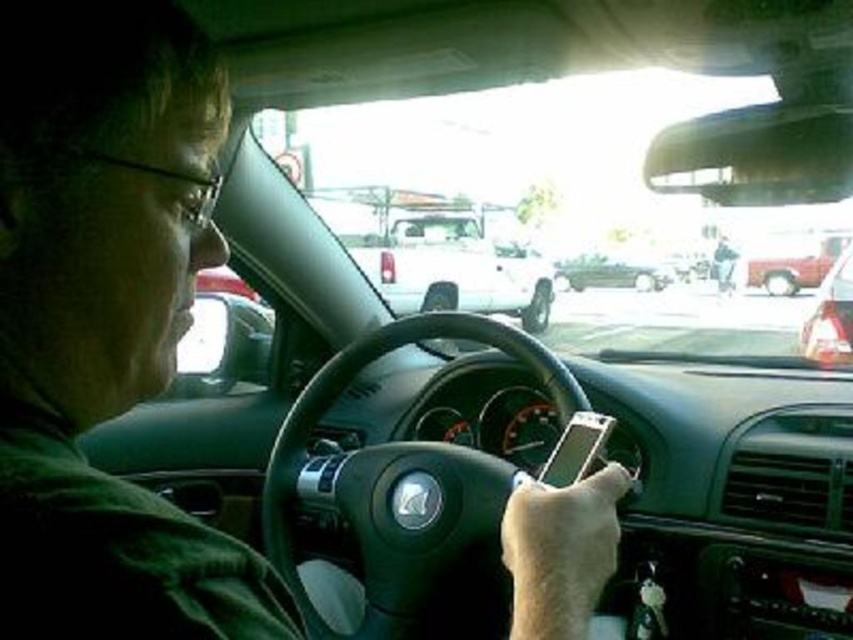
Question: Which of the following is the farthest from the observer?

Choices:
 (A) shiny silver car at right
 (B) white matte truck at center
 (C) green matte shirt at center

Answer: (B)

Question: Is green matte shirt at center thinner than metallic red truck at right?

Choices:
 (A) yes
 (B) no

Answer: (A)

Question: Which point is farther to the camera?

Choices:
 (A) green matte shirt at center
 (B) metallic red truck at right
 (C) shiny black sedan at center
 (D) shiny silver car at right

Answer: (C)

Question: Where is white matte truck at center located in relation to shiny silver car at right in the image?

Choices:
 (A) below
 (B) above

Answer: (B)

Question: Is shiny silver car at right positioned behind shiny black sedan at center?

Choices:
 (A) no
 (B) yes

Answer: (A)

Question: Which object is the closest to the black leather steering wheel at center?

Choices:
 (A) metallic red truck at right
 (B) white matte truck at center

Answer: (B)